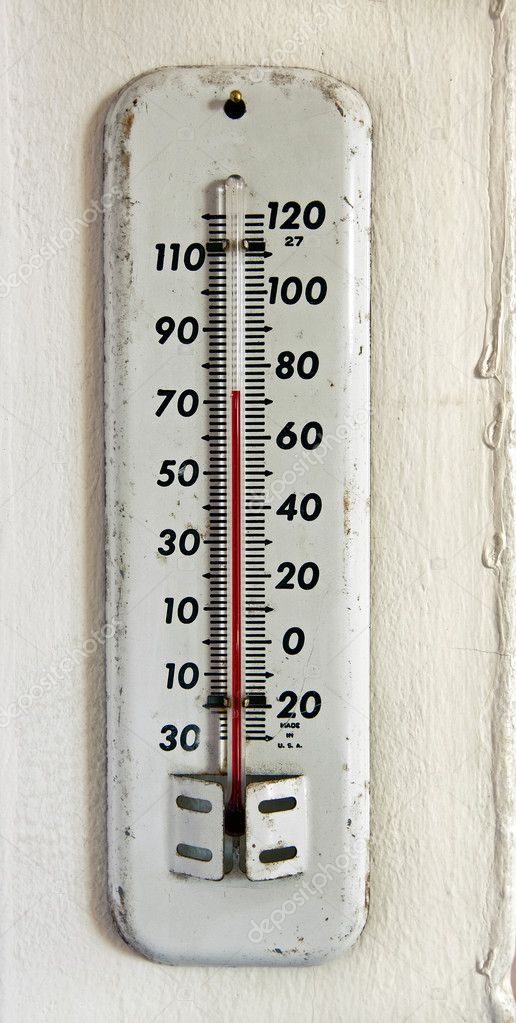
Locate an element on the screen. This screenshot has width=516, height=1023. wall is located at coordinates (396, 408).